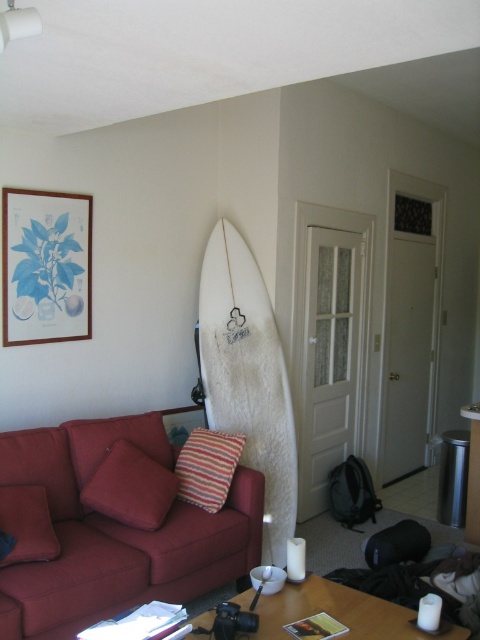
You are standing in the living room and want to check if you can comfortably walk around the white fuzzy surfboard at center without bumping into it. The surfboard is placed in the center of the room. If the minimum safe distance for walking around objects is 3 feet, can you safely walk around it?

The white fuzzy surfboard at center is 10.80 feet away from the viewer, which is more than the 3 feet minimum safe distance required. Therefore, you can safely walk around it.

You are planning to hang a new picture on the wall between the white fuzzy surfboard at center and the wooden framed print at upper left. Which object should you avoid placing the new picture in front of to ensure it doesn t block either object?

You should avoid placing the new picture in front of the white fuzzy surfboard at center because it is much taller than the wooden framed print at upper left, so it would block the new picture more significantly.

You are standing in the living room and want to place a small plant between the two points labeled point (x=92, y=502) and point (x=32, y=522). Which point should the plant be closer to if you want it to be in front of the surfboard?

The plant should be closer to point (x=32, y=522) because point (x=92, y=502) is behind point (x=32, y=522), so placing it near the front point would position it in front of the surfboard.